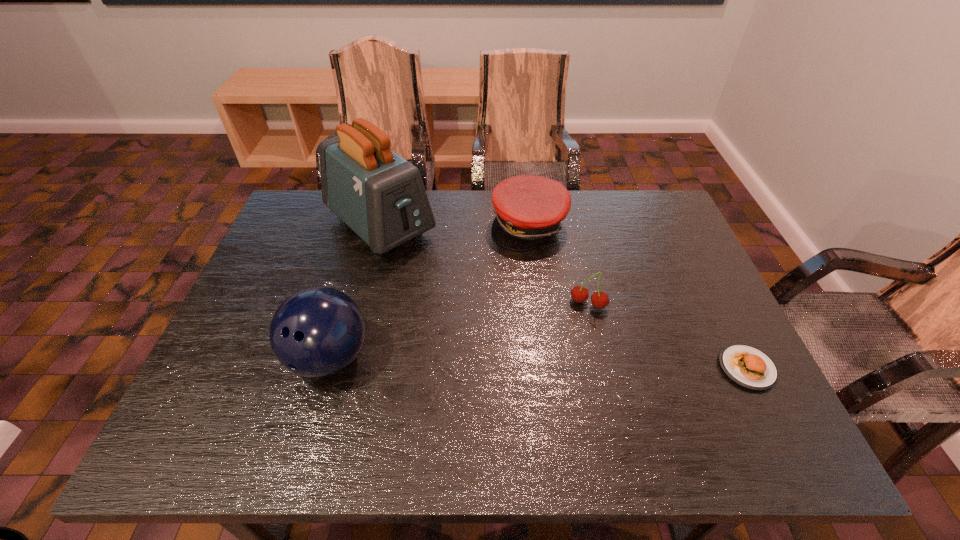
You are a GUI agent. You are given a task and a screenshot of the screen. Output one action in this format:
    pyautogui.click(x=<x>, y=<y>)
    Task: Click on the vacant area situated on the surface of the third nearest object
    Image resolution: width=960 pixels, height=540 pixels.
    Given the screenshot: What is the action you would take?
    pyautogui.click(x=560, y=367)

Where is `vacant space located on the surface of the third nearest object`? This screenshot has height=540, width=960. vacant space located on the surface of the third nearest object is located at coordinates (569, 345).

The width and height of the screenshot is (960, 540). In order to click on blank space located on the surface of the third nearest object in this screenshot , I will do `click(558, 371)`.

The image size is (960, 540). What are the coordinates of `free space located 0.160m on the front-facing side of the cap` in the screenshot? It's located at (559, 291).

Locate an element on the screen. blank space located on the front-facing side of the cap is located at coordinates (564, 302).

At what (x,y) coordinates should I click in order to perform the action: click on vacant space situated 0.360m on the front-facing side of the cap. Please return your answer as a coordinate pair (x, y). Looking at the image, I should click on (588, 352).

At what (x,y) coordinates should I click in order to perform the action: click on toaster situated at the far edge. Please return your answer as a coordinate pair (x, y). The height and width of the screenshot is (540, 960). Looking at the image, I should click on (379, 195).

Where is `cap that is at the far edge`? cap that is at the far edge is located at coordinates (529, 209).

Where is `bowling ball located in the near edge section of the desktop`? bowling ball located in the near edge section of the desktop is located at coordinates (316, 332).

Locate an element on the screen. food positioned at the near edge is located at coordinates (746, 366).